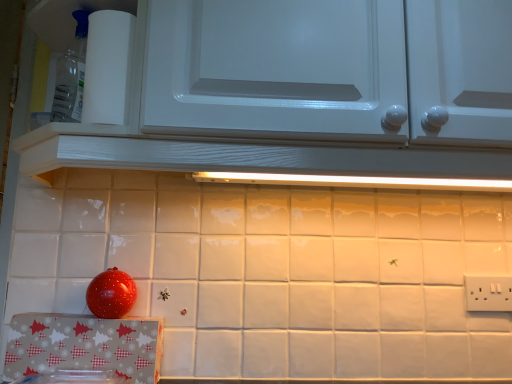
Question: From the image's perspective, is white plastic electric outlet at lower right over white paper towel at upper left?

Choices:
 (A) no
 (B) yes

Answer: (A)

Question: Is white paper towel at upper left completely or partially inside white plastic electric outlet at lower right?

Choices:
 (A) no
 (B) yes

Answer: (A)

Question: Considering the relative positions of white plastic electric outlet at lower right and white paper towel at upper left in the image provided, is white plastic electric outlet at lower right to the left of white paper towel at upper left from the viewer's perspective?

Choices:
 (A) yes
 (B) no

Answer: (B)

Question: Is white plastic electric outlet at lower right taller than white paper towel at upper left?

Choices:
 (A) no
 (B) yes

Answer: (A)

Question: Is white plastic electric outlet at lower right facing away from white paper towel at upper left?

Choices:
 (A) no
 (B) yes

Answer: (A)

Question: From the image's perspective, relative to white paper towel at upper left, is white plastic electric outlet at lower right above or below?

Choices:
 (A) above
 (B) below

Answer: (B)

Question: Looking at the image, does white plastic electric outlet at lower right seem bigger or smaller compared to white paper towel at upper left?

Choices:
 (A) small
 (B) big

Answer: (A)

Question: Is white plastic electric outlet at lower right taller or shorter than white paper towel at upper left?

Choices:
 (A) short
 (B) tall

Answer: (A)

Question: Is white plastic electric outlet at lower right wider or thinner than white paper towel at upper left?

Choices:
 (A) thin
 (B) wide

Answer: (A)

Question: From their relative heights in the image, would you say white glossy cabinet at upper center is taller or shorter than white plastic electric outlet at lower right?

Choices:
 (A) tall
 (B) short

Answer: (A)

Question: Is white glossy cabinet at upper center in front of or behind white plastic electric outlet at lower right in the image?

Choices:
 (A) front
 (B) behind

Answer: (A)

Question: Would you say white glossy cabinet at upper center is inside or outside white plastic electric outlet at lower right?

Choices:
 (A) inside
 (B) outside

Answer: (B)

Question: From a real-world perspective, relative to white plastic electric outlet at lower right, is white glossy cabinet at upper center vertically above or below?

Choices:
 (A) below
 (B) above

Answer: (B)

Question: In terms of height, does white paper towel at upper left look taller or shorter compared to white plastic electric outlet at lower right?

Choices:
 (A) tall
 (B) short

Answer: (A)

Question: Does point (60, 89) appear closer or farther from the camera than point (500, 283)?

Choices:
 (A) farther
 (B) closer

Answer: (B)